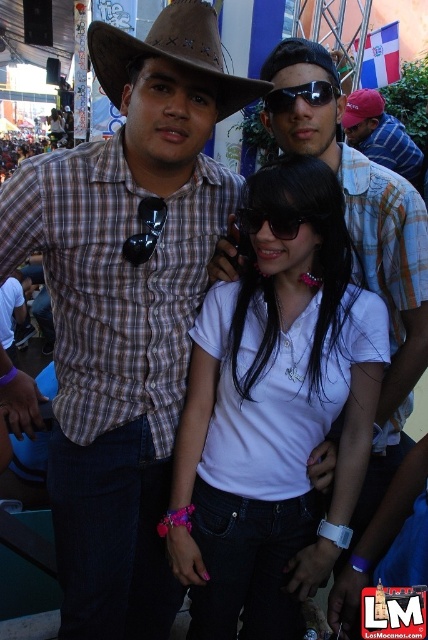
You are a photographer trying to focus on the black plastic goggles at center in the image. However, your camera is currently focused on the brown leather fedora at upper left. Based on their positions, should you adjust the focus downward or upward to capture the goggles?

The brown leather fedora at upper left is above the black plastic goggles at center. To focus on the goggles, you should adjust the focus downward.

Please look at the three people in the image. The person on the left has a brown cowboy hat and dark sunglasses hanging from their shirt collar. The central figure is a woman in a white polo shirt and dark jeans. The third person is behind and to the right of the central figure. Now, there is a point marked at coordinates (125, 307). Which of the three people is this point indicating?

The point marked at coordinates (125, 307) indicates the brown plaid shirt at center.